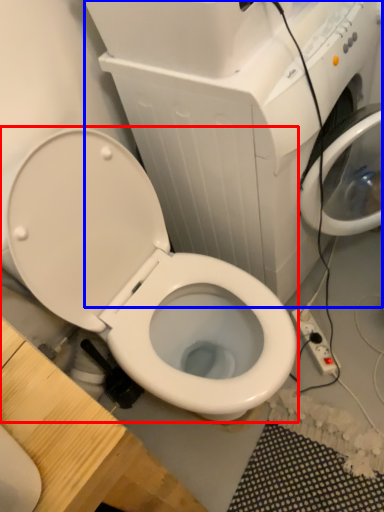
Question: Which object appears closest to the camera in this image, toilet (highlighted by a red box) or appliance (highlighted by a blue box)?

Choices:
 (A) toilet
 (B) appliance

Answer: (A)